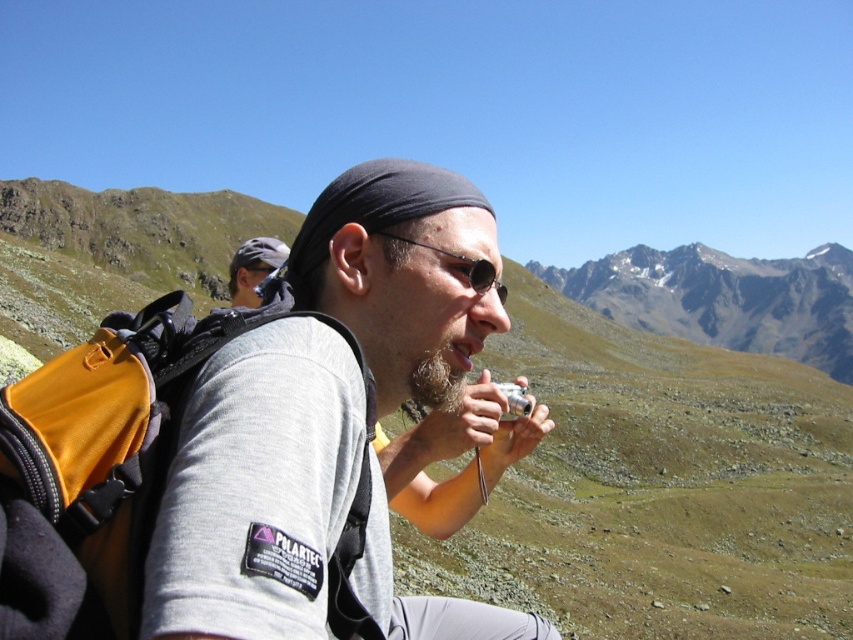
Can you confirm if matte gray cap at upper left is positioned to the right of black reflective sunglasses at center?

Incorrect, matte gray cap at upper left is not on the right side of black reflective sunglasses at center.

Between matte gray cap at upper left and black reflective sunglasses at center, which one is positioned lower?

black reflective sunglasses at center is lower down.

Image resolution: width=853 pixels, height=640 pixels. What do you see at coordinates (253, 268) in the screenshot?
I see `matte gray cap at upper left` at bounding box center [253, 268].

This screenshot has width=853, height=640. In order to click on matte gray cap at upper left in this screenshot , I will do `click(253, 268)`.

How distant is gray fabric shirt at center from black reflective sunglasses at center?

gray fabric shirt at center is 5.98 meters from black reflective sunglasses at center.

Does point (223, 586) come in front of point (488, 282)?

Yes, it is in front of point (488, 282).

The image size is (853, 640). What are the coordinates of `gray fabric shirt at center` in the screenshot? It's located at (256, 490).

You are a GUI agent. You are given a task and a screenshot of the screen. Output one action in this format:
    pyautogui.click(x=<x>, y=<y>)
    Task: Click on the gray fabric shirt at center
    
    Given the screenshot: What is the action you would take?
    point(256,490)

Based on the photo, which is above, gray fabric shirt at center or matte gray cap at upper left?

matte gray cap at upper left

Who is positioned more to the right, gray fabric shirt at center or matte gray cap at upper left?

gray fabric shirt at center is more to the right.

This screenshot has height=640, width=853. Find the location of `gray fabric shirt at center`. gray fabric shirt at center is located at coordinates (256, 490).

Locate an element on the screen. gray fabric shirt at center is located at coordinates (256, 490).